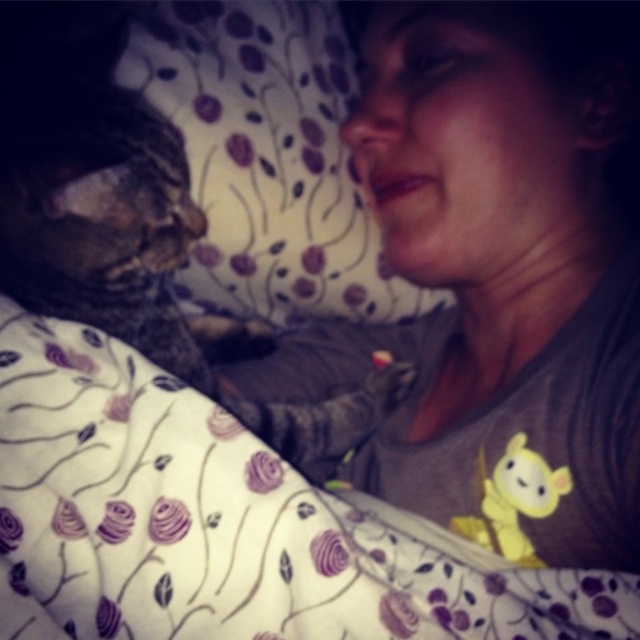
From the picture: You are a photographer standing in the scene and want to take a closeup photo of the fluffy fabric pillow at upper left without moving any objects. Can you reach it while staying in your current position?

The fluffy fabric pillow at upper left and viewer are 32.00 inches apart from each other, so yes, you can reach the fluffy fabric pillow at upper left while staying in your current position since 32.00 inches is within a comfortable arm reach distance.

You are a photographer trying to capture a closeup of the tabby fur cat at left and the fluffy white blanket at lower left. Which object should you zoom in on to ensure both are in frame without moving the camera?

You should zoom in on the tabby fur cat at left because the fluffy white blanket at lower left is smaller than the tabby fur cat at left, so focusing on the larger object will keep both in frame.

You are trying to place a small book between the fluffy fabric pillow at upper left and the yellow plush toy at center. Based on their heights, which object should you place the book on top of to ensure it doesn

The fluffy fabric pillow at upper left is taller than the yellow plush toy at center, so placing the book on top of the fluffy fabric pillow at upper left would provide a stable and elevated surface.